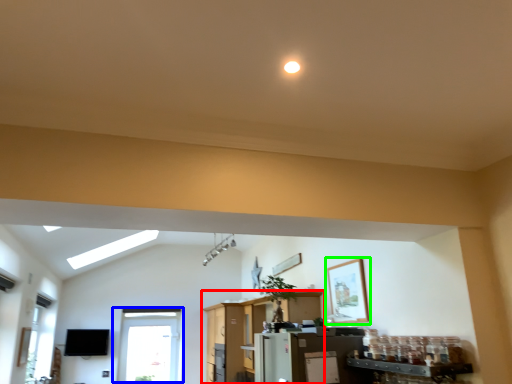
Question: Based on their relative distances, which object is farther from entertainment center (highlighted by a red box)? Choose from window (highlighted by a blue box) and picture frame (highlighted by a green box).

Choices:
 (A) window
 (B) picture frame

Answer: (B)